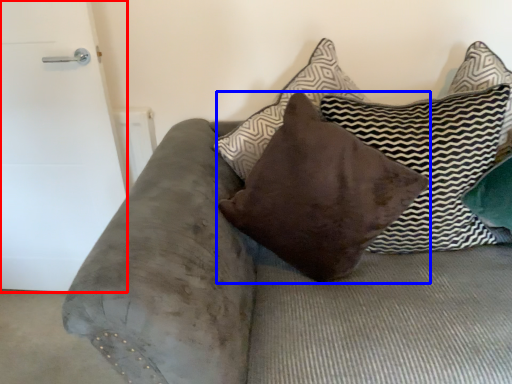
Question: Which of the following is the closest to the observer, door (highlighted by a red box) or pillow (highlighted by a blue box)?

Choices:
 (A) door
 (B) pillow

Answer: (B)